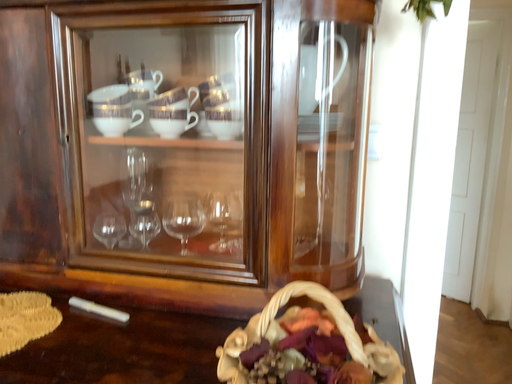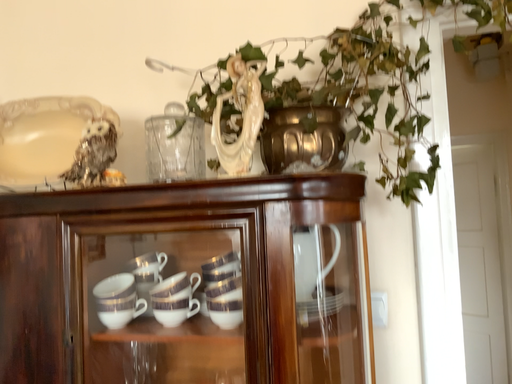
Question: How did the camera likely rotate when shooting the video?

Choices:
 (A) rotated upward
 (B) rotated downward

Answer: (A)